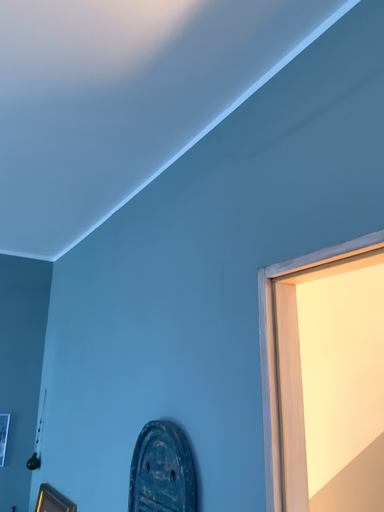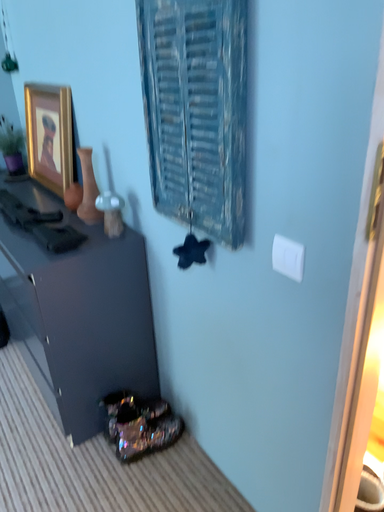
Question: Which way did the camera rotate in the video?

Choices:
 (A) rotated upward
 (B) rotated downward

Answer: (B)